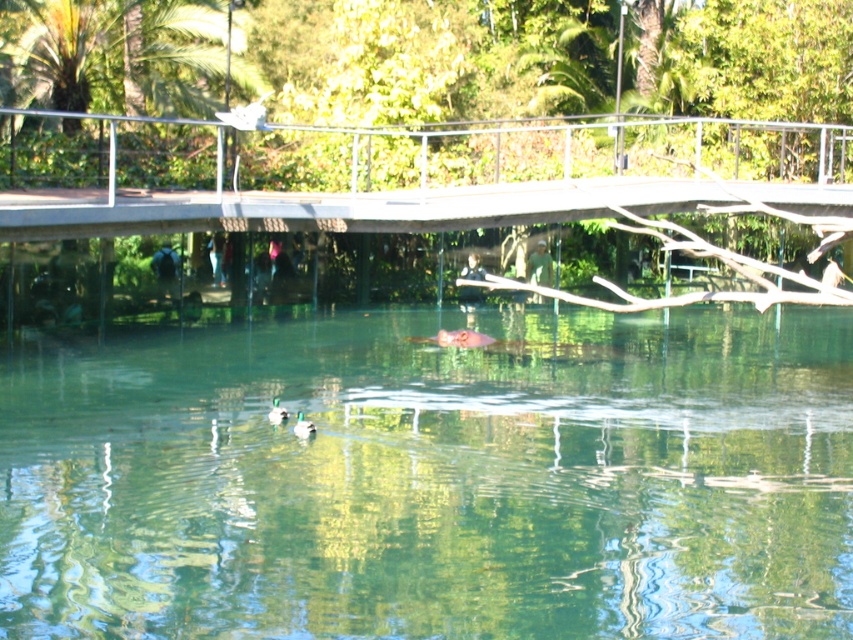
Can you confirm if metal bridge at center is smaller than green matte duck at center?

Actually, metal bridge at center might be larger than green matte duck at center.

Between point (42, 113) and point (279, 406), which one is positioned behind?

The point (42, 113) is more distant.

Identify the location of metal bridge at center. (407, 189).

Can you confirm if clear water at center is shorter than green matte duck at center?

A: In fact, clear water at center may be taller than green matte duck at center.

Can you confirm if clear water at center is positioned above green matte duck at center?

Correct, clear water at center is located above green matte duck at center.

At what (x,y) coordinates should I click in order to perform the action: click on clear water at center. Please return your answer as a coordinate pair (x, y). Image resolution: width=853 pixels, height=640 pixels. Looking at the image, I should click on (431, 477).

Which is more to the right, clear water at center or green matte duck at lower center?

From the viewer's perspective, clear water at center appears more on the right side.

Does clear water at center appear under green matte duck at lower center?

No.

Where is `clear water at center`? The image size is (853, 640). clear water at center is located at coordinates (431, 477).